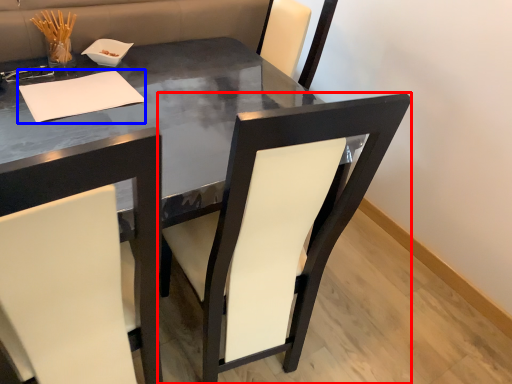
Question: Which point is closer to the camera, chair (highlighted by a red box) or notepad (highlighted by a blue box)?

Choices:
 (A) chair
 (B) notepad

Answer: (A)